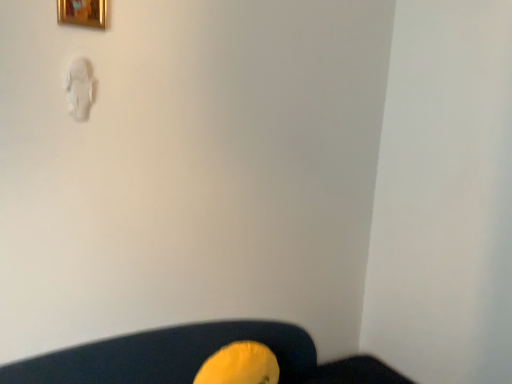
Question: From a real-world perspective, does yellow fabric bean bag chair at lower center sit lower than gold metallic picture frame at upper left?

Choices:
 (A) no
 (B) yes

Answer: (B)

Question: From a real-world perspective, is yellow fabric bean bag chair at lower center positioned over gold metallic picture frame at upper left based on gravity?

Choices:
 (A) yes
 (B) no

Answer: (B)

Question: Is yellow fabric bean bag chair at lower center aimed at gold metallic picture frame at upper left?

Choices:
 (A) yes
 (B) no

Answer: (B)

Question: From the image's perspective, is yellow fabric bean bag chair at lower center over gold metallic picture frame at upper left?

Choices:
 (A) no
 (B) yes

Answer: (A)

Question: Considering the relative sizes of yellow fabric bean bag chair at lower center and gold metallic picture frame at upper left in the image provided, is yellow fabric bean bag chair at lower center bigger than gold metallic picture frame at upper left?

Choices:
 (A) yes
 (B) no

Answer: (A)

Question: Can you confirm if yellow fabric bean bag chair at lower center is taller than gold metallic picture frame at upper left?

Choices:
 (A) yes
 (B) no

Answer: (A)

Question: Is gold metallic picture frame at upper left not near yellow fabric bean bag chair at lower center?

Choices:
 (A) yes
 (B) no

Answer: (A)

Question: From a real-world perspective, is gold metallic picture frame at upper left beneath yellow fabric bean bag chair at lower center?

Choices:
 (A) yes
 (B) no

Answer: (B)

Question: Does gold metallic picture frame at upper left appear on the right side of yellow fabric bean bag chair at lower center?

Choices:
 (A) no
 (B) yes

Answer: (A)

Question: Is gold metallic picture frame at upper left next to yellow fabric bean bag chair at lower center?

Choices:
 (A) yes
 (B) no

Answer: (B)

Question: Is gold metallic picture frame at upper left thinner than yellow fabric bean bag chair at lower center?

Choices:
 (A) no
 (B) yes

Answer: (B)

Question: Could you tell me if gold metallic picture frame at upper left is turned towards yellow fabric bean bag chair at lower center?

Choices:
 (A) yes
 (B) no

Answer: (B)

Question: From the image's perspective, relative to gold metallic picture frame at upper left, is yellow fabric bean bag chair at lower center above or below?

Choices:
 (A) below
 (B) above

Answer: (A)